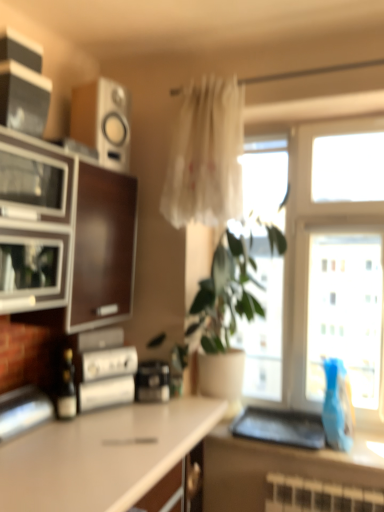
Question: From a real-world perspective, is white matte countertop at lower left, the second countertop from the right, below smooth brown countertop at lower right, which ranks as the second countertop in bottom-to-top order?

Choices:
 (A) yes
 (B) no

Answer: (A)

Question: Would you say white matte countertop at lower left, the second countertop from the right, contains smooth brown countertop at lower right, which is the first countertop from right to left?

Choices:
 (A) yes
 (B) no

Answer: (B)

Question: Does white matte countertop at lower left, arranged as the second countertop when viewed from the top, have a lesser width compared to smooth brown countertop at lower right, placed as the 1th countertop when sorted from top to bottom?

Choices:
 (A) no
 (B) yes

Answer: (A)

Question: Considering the relative sizes of white matte countertop at lower left, arranged as the second countertop when viewed from the top, and smooth brown countertop at lower right, placed as the 1th countertop when sorted from top to bottom, in the image provided, is white matte countertop at lower left, arranged as the second countertop when viewed from the top, bigger than smooth brown countertop at lower right, placed as the 1th countertop when sorted from top to bottom,?

Choices:
 (A) yes
 (B) no

Answer: (A)

Question: Considering the relative sizes of white matte countertop at lower left, the second countertop from the right, and smooth brown countertop at lower right, which ranks as the second countertop in bottom-to-top order, in the image provided, is white matte countertop at lower left, the second countertop from the right, smaller than smooth brown countertop at lower right, which ranks as the second countertop in bottom-to-top order,?

Choices:
 (A) yes
 (B) no

Answer: (B)

Question: Is white matte countertop at lower left, arranged as the second countertop when viewed from the top, taller or shorter than metallic silver toaster at left, positioned as the 1th appliance in bottom-to-top order?

Choices:
 (A) short
 (B) tall

Answer: (B)

Question: Is point (105, 411) closer or farther from the camera than point (44, 403)?

Choices:
 (A) closer
 (B) farther

Answer: (B)

Question: Is white matte countertop at lower left, arranged as the 1th countertop when ordered from the bottom, to the left or to the right of metallic silver toaster at left, positioned as the 1th appliance in bottom-to-top order, in the image?

Choices:
 (A) left
 (B) right

Answer: (B)

Question: From the image's perspective, is white matte countertop at lower left, arranged as the 1th countertop when ordered from the bottom, located above or below metallic silver toaster at left, positioned as the 1th appliance in bottom-to-top order?

Choices:
 (A) above
 (B) below

Answer: (B)

Question: In the image, is matte black speaker at upper left, which ranks as the third appliance in bottom-to-top order, positioned in front of or behind smooth brown countertop at lower right, which is the first countertop from right to left?

Choices:
 (A) front
 (B) behind

Answer: (A)

Question: Choose the correct answer: Is matte black speaker at upper left, which ranks as the third appliance in bottom-to-top order, inside smooth brown countertop at lower right, which is the first countertop from right to left, or outside it?

Choices:
 (A) outside
 (B) inside

Answer: (A)

Question: Considering the positions of matte black speaker at upper left, arranged as the 2th appliance when viewed from the top, and smooth brown countertop at lower right, which is the first countertop from right to left, in the image, is matte black speaker at upper left, arranged as the 2th appliance when viewed from the top, wider or thinner than smooth brown countertop at lower right, which is the first countertop from right to left,?

Choices:
 (A) thin
 (B) wide

Answer: (A)

Question: Is point (41, 92) closer or farther from the camera than point (372, 456)?

Choices:
 (A) farther
 (B) closer

Answer: (B)

Question: Considering the positions of blue glass vase at right and matte glass bottle at center in the image, is blue glass vase at right taller or shorter than matte glass bottle at center?

Choices:
 (A) tall
 (B) short

Answer: (A)

Question: From a real-world perspective, relative to matte glass bottle at center, is blue glass vase at right vertically above or below?

Choices:
 (A) below
 (B) above

Answer: (A)